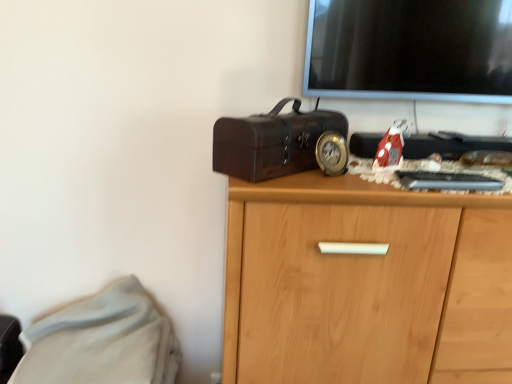
Question: Is light wood cabinet at center in front of or behind white soft fabric at lower left in the image?

Choices:
 (A) behind
 (B) front

Answer: (B)

Question: Considering the positions of light wood cabinet at center and white soft fabric at lower left in the image, is light wood cabinet at center wider or thinner than white soft fabric at lower left?

Choices:
 (A) wide
 (B) thin

Answer: (B)

Question: Which object is positioned farthest from the white soft fabric at lower left?

Choices:
 (A) shiny dark brown suitcase at center
 (B) light wood cabinet at center

Answer: (A)

Question: Which of these objects is positioned closest to the light wood cabinet at center?

Choices:
 (A) shiny dark brown suitcase at center
 (B) white soft fabric at lower left

Answer: (A)